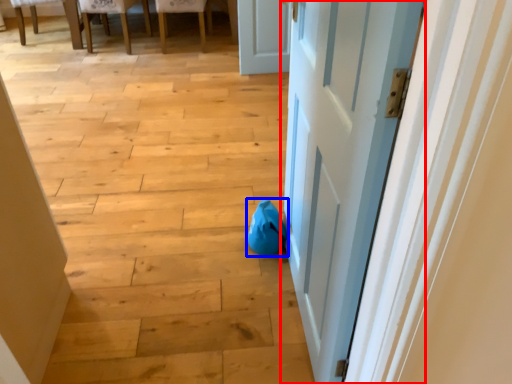
Question: Among these objects, which one is farthest to the camera, door (highlighted by a red box) or bean bag chair (highlighted by a blue box)?

Choices:
 (A) door
 (B) bean bag chair

Answer: (B)